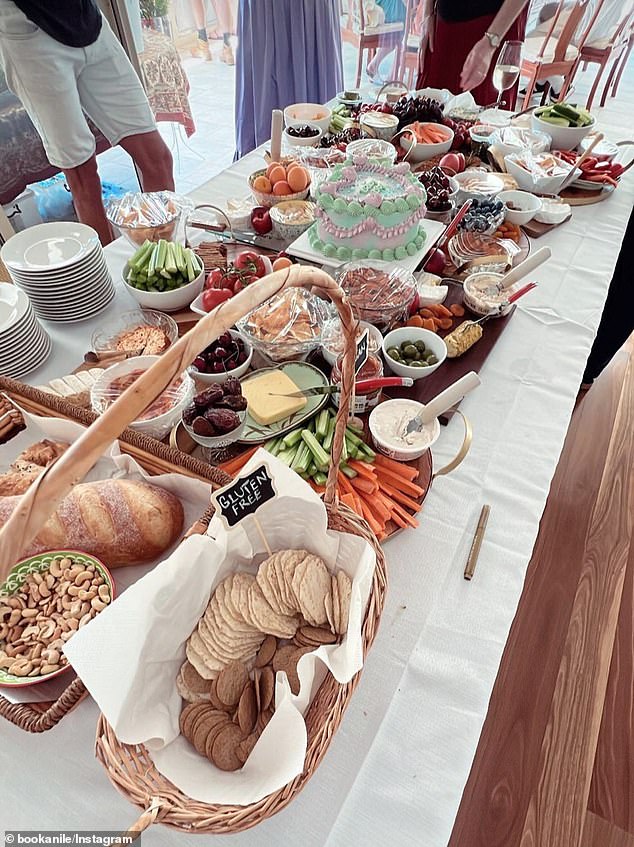
Locate an element on the screen. The image size is (634, 847). floor wooden is located at coordinates (564, 673).